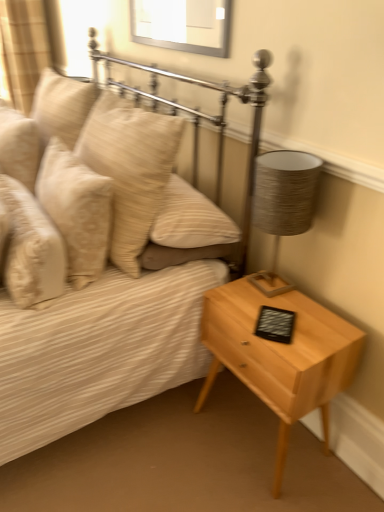
Where is `empty space that is ontop of textured gray lampshade at right (from a real-world perspective)`? The height and width of the screenshot is (512, 384). empty space that is ontop of textured gray lampshade at right (from a real-world perspective) is located at coordinates (281, 160).